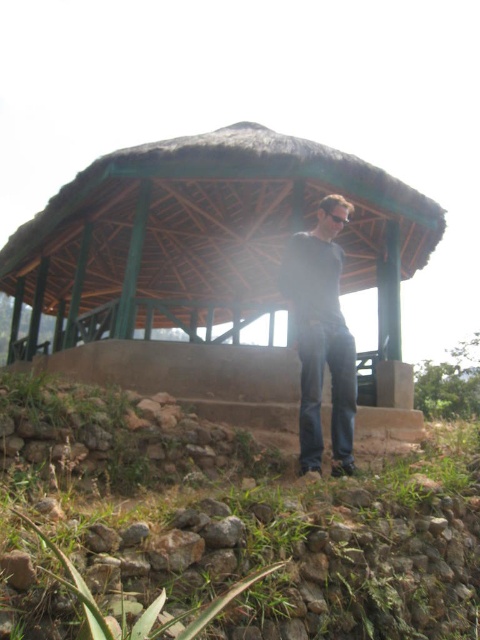
Question: Can you confirm if dark gray sweater at center is positioned below black plastic goggles at center?

Choices:
 (A) yes
 (B) no

Answer: (A)

Question: Is green wood gazebo at center in front of dark gray sweater at center?

Choices:
 (A) yes
 (B) no

Answer: (B)

Question: Is green wood gazebo at center closer to the viewer compared to black plastic goggles at center?

Choices:
 (A) yes
 (B) no

Answer: (A)

Question: Which of these objects is positioned closest to the green wood gazebo at center?

Choices:
 (A) dark gray sweater at center
 (B) black plastic goggles at center

Answer: (A)

Question: Based on their relative distances, which object is nearer to the green wood gazebo at center?

Choices:
 (A) dark gray sweater at center
 (B) black plastic goggles at center

Answer: (A)

Question: Which point is closer to the camera?

Choices:
 (A) black plastic goggles at center
 (B) dark gray sweater at center
 (C) green wood gazebo at center

Answer: (B)